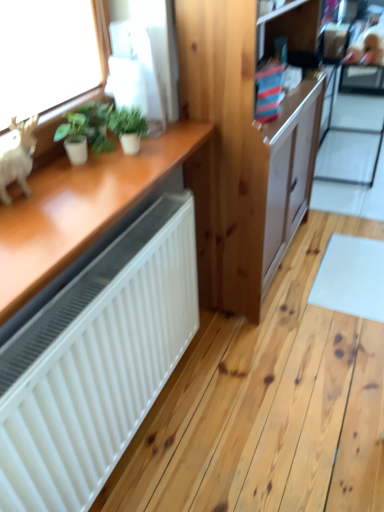
Question: Would you say green matte plant at upper left, the second houseplant in the right-to-left sequence, contains green matte plant at upper left, placed as the 1th houseplant when sorted from right to left?

Choices:
 (A) yes
 (B) no

Answer: (B)

Question: Could you tell me if green matte plant at upper left, which is the first houseplant from left to right, is facing green matte plant at upper left, placed as the 1th houseplant when sorted from right to left?

Choices:
 (A) yes
 (B) no

Answer: (B)

Question: Is green matte plant at upper left, which is the first houseplant from left to right, located outside green matte plant at upper left, arranged as the 2th houseplant when viewed from the left?

Choices:
 (A) no
 (B) yes

Answer: (B)

Question: Is green matte plant at upper left, the second houseplant in the right-to-left sequence, bigger than green matte plant at upper left, arranged as the 2th houseplant when viewed from the left?

Choices:
 (A) no
 (B) yes

Answer: (B)

Question: Considering the relative sizes of green matte plant at upper left, which is the first houseplant from left to right, and green matte plant at upper left, placed as the 1th houseplant when sorted from right to left, in the image provided, is green matte plant at upper left, which is the first houseplant from left to right, taller than green matte plant at upper left, placed as the 1th houseplant when sorted from right to left,?

Choices:
 (A) no
 (B) yes

Answer: (A)

Question: Is the depth of green matte plant at upper left, which is the first houseplant from left to right, greater than that of green matte plant at upper left, arranged as the 2th houseplant when viewed from the left?

Choices:
 (A) no
 (B) yes

Answer: (A)

Question: Would you say natural wood cabinet at center is outside transparent glass screen door at upper right?

Choices:
 (A) yes
 (B) no

Answer: (A)

Question: From a real-world perspective, is natural wood cabinet at center physically below transparent glass screen door at upper right?

Choices:
 (A) yes
 (B) no

Answer: (B)

Question: From the image's perspective, would you say natural wood cabinet at center is positioned over transparent glass screen door at upper right?

Choices:
 (A) no
 (B) yes

Answer: (A)

Question: Can you confirm if natural wood cabinet at center is taller than transparent glass screen door at upper right?

Choices:
 (A) yes
 (B) no

Answer: (A)

Question: Is natural wood cabinet at center facing towards transparent glass screen door at upper right?

Choices:
 (A) yes
 (B) no

Answer: (B)

Question: Is natural wood cabinet at center in front of transparent glass screen door at upper right?

Choices:
 (A) no
 (B) yes

Answer: (B)

Question: Can you confirm if green matte plant at upper left, arranged as the 2th houseplant when viewed from the left, is thinner than white matte figurine at left?

Choices:
 (A) no
 (B) yes

Answer: (A)